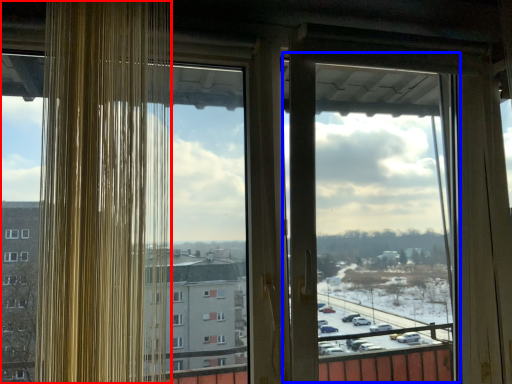
Question: Which object appears farthest to the camera in this image, window (highlighted by a red box) or screen door (highlighted by a blue box)?

Choices:
 (A) window
 (B) screen door

Answer: (B)